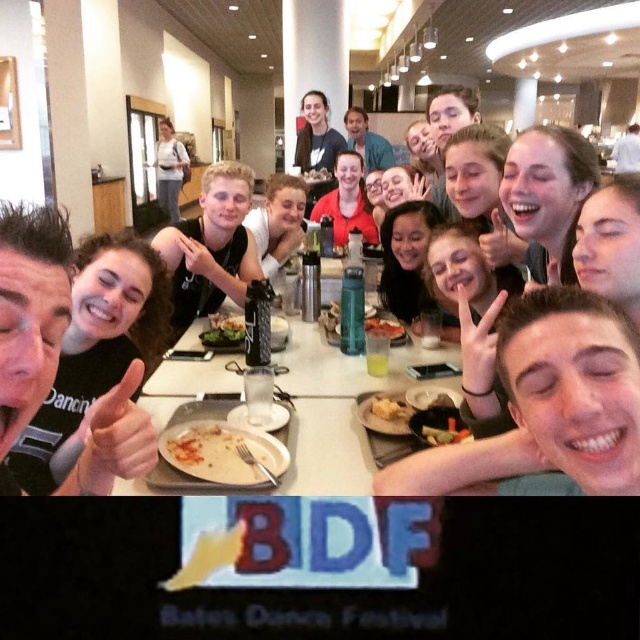
Can you confirm if white matte plate at center is positioned to the right of smooth white shirt at center?

Correct, you'll find white matte plate at center to the right of smooth white shirt at center.

Which is below, white matte plate at center or smooth white shirt at center?

white matte plate at center

Where is `white matte plate at center`? This screenshot has width=640, height=640. white matte plate at center is located at coordinates (221, 452).

At what (x,y) coordinates should I click in order to perform the action: click on white matte plate at center. Please return your answer as a coordinate pair (x, y). The image size is (640, 640). Looking at the image, I should click on (221, 452).

Can you confirm if smooth white shirt at center is shorter than matte red shirt at center?

Yes.

The height and width of the screenshot is (640, 640). In order to click on smooth white shirt at center in this screenshot , I will do `click(278, 221)`.

Between matte blue shirt at upper center and green leafy salad at center, which one appears on the left side from the viewer's perspective?

green leafy salad at center is more to the left.

Between point (364, 140) and point (282, 328), which one is positioned in front?

Point (282, 328) is in front.

Does point (365, 132) come farther from viewer compared to point (278, 337)?

Yes, point (365, 132) is behind point (278, 337).

At what (x,y) coordinates should I click in order to perform the action: click on matte blue shirt at upper center. Please return your answer as a coordinate pair (x, y). Image resolution: width=640 pixels, height=640 pixels. Looking at the image, I should click on (365, 141).